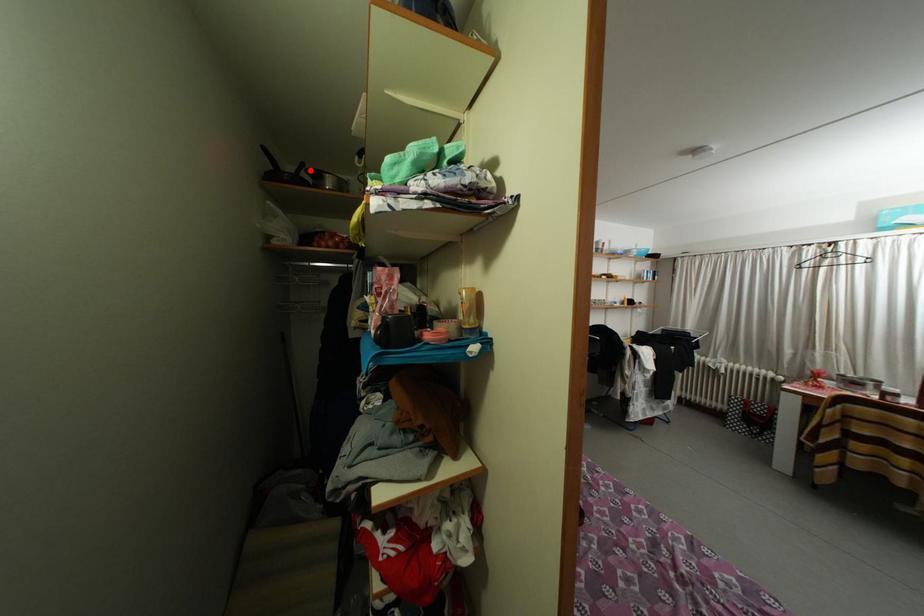
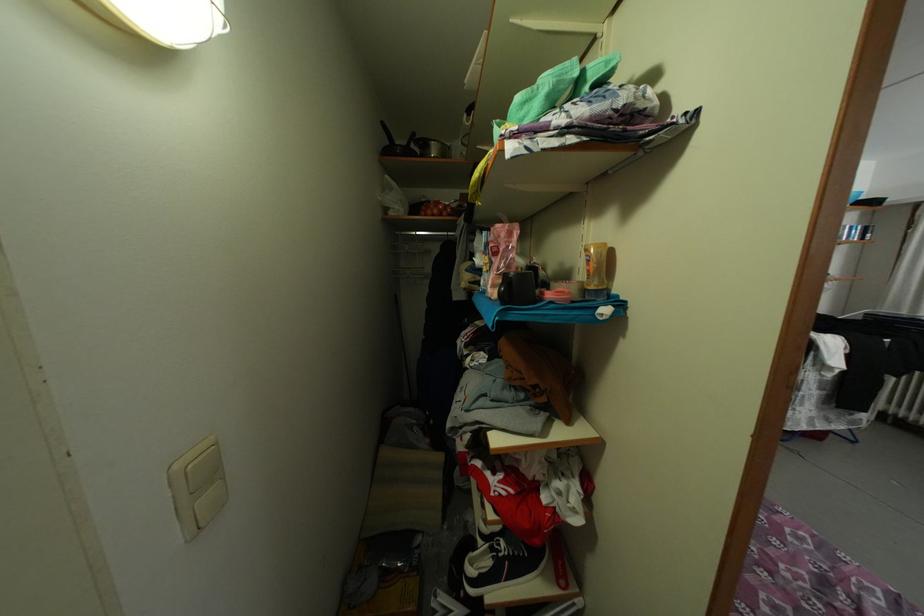
Locate, in the second image, the point that corresponds to the highlighted location in the first image.

(421, 140)